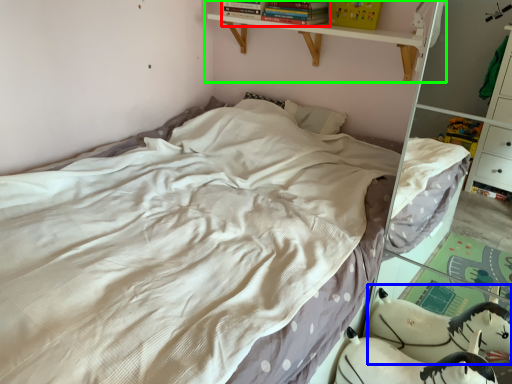
Question: Estimate the real-world distances between objects in this image. Which object is closer to book (highlighted by a red box), animal (highlighted by a blue box) or shelf (highlighted by a green box)?

Choices:
 (A) animal
 (B) shelf

Answer: (B)